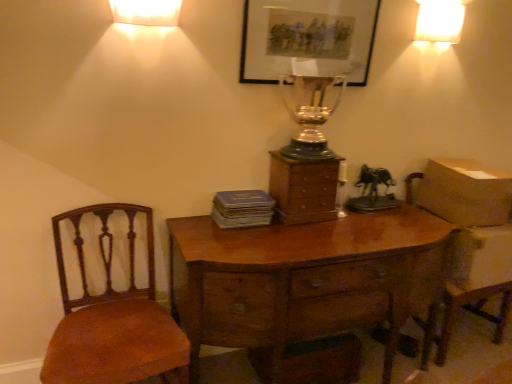
Image resolution: width=512 pixels, height=384 pixels. Identify the location of vacant space in front of matte gray book at center. (243, 238).